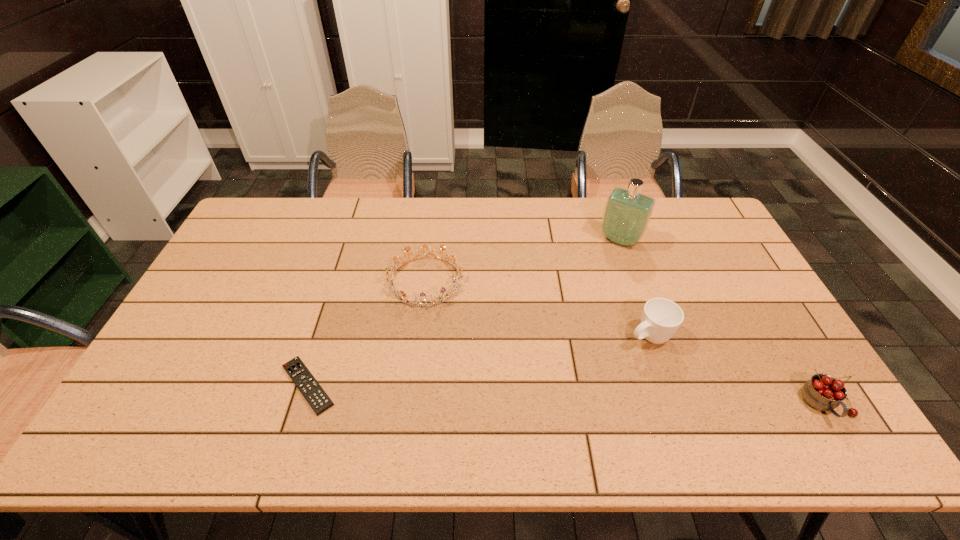
Find the location of `the shortest object`. the shortest object is located at coordinates (314, 394).

Find the location of a particular element. This screenshot has width=960, height=540. the leftmost object is located at coordinates (314, 394).

In order to click on the rightmost object in this screenshot , I will do [823, 392].

Locate an element on the screen. The height and width of the screenshot is (540, 960). the tallest object is located at coordinates (627, 213).

Identify the location of perfume. (627, 213).

Locate an element on the screen. the second object from left to right is located at coordinates (457, 279).

What are the coordinates of `the second farthest object` in the screenshot? It's located at (457, 279).

Find the location of a particular element. The width and height of the screenshot is (960, 540). the third farthest object is located at coordinates (661, 318).

Where is `free space located 0.170m on the right of the leftmost object`? The image size is (960, 540). free space located 0.170m on the right of the leftmost object is located at coordinates click(x=406, y=386).

Image resolution: width=960 pixels, height=540 pixels. In order to click on vacant position located 0.370m on the front label of the perfume in this screenshot , I will do `click(565, 323)`.